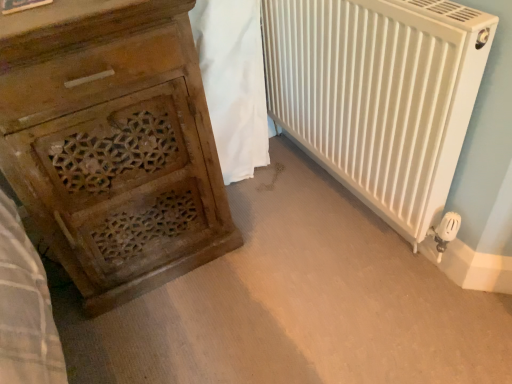
You are a GUI agent. You are given a task and a screenshot of the screen. Output one action in this format:
    pyautogui.click(x=<x>, y=<y>)
    Task: Click on the vacant area located to the right-hand side of wooden carved chest of drawers at left
    The image size is (512, 384).
    Given the screenshot: What is the action you would take?
    pyautogui.click(x=282, y=251)